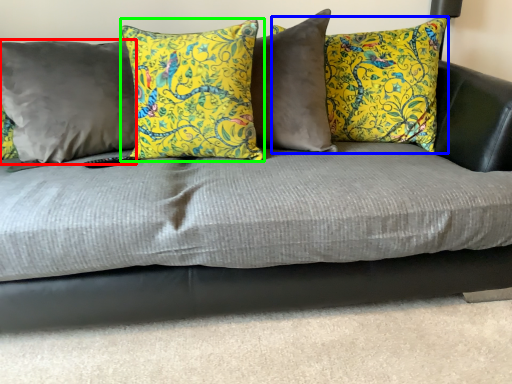
Question: Estimate the real-world distances between objects in this image. Which object is closer to pillow (highlighted by a red box), pillow (highlighted by a blue box) or pillow (highlighted by a green box)?

Choices:
 (A) pillow
 (B) pillow

Answer: (B)